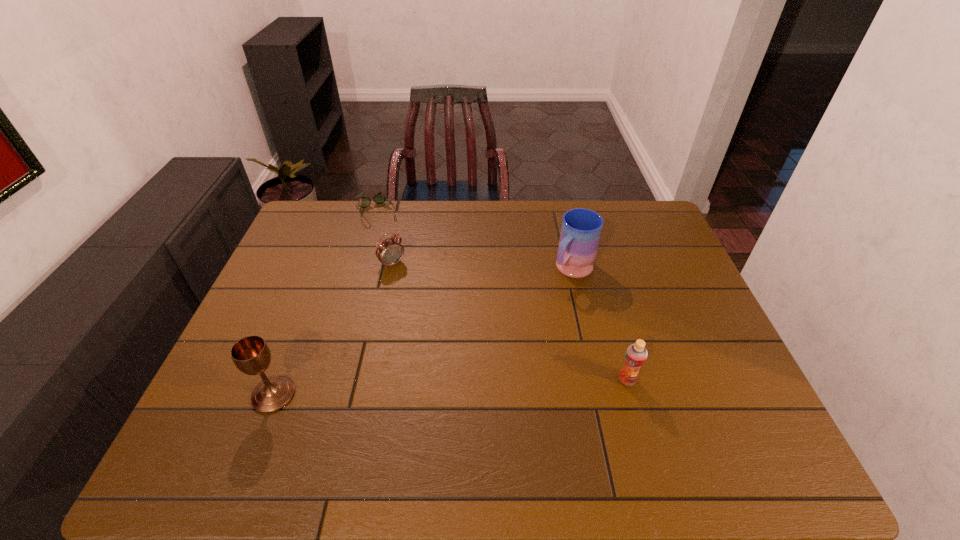
The height and width of the screenshot is (540, 960). Find the location of `free space between the third tallest object and the alarm clock`. free space between the third tallest object and the alarm clock is located at coordinates (510, 322).

Where is `empty space between the chalice and the mug`? empty space between the chalice and the mug is located at coordinates (422, 332).

At what (x,y) coordinates should I click in order to perform the action: click on free area in between the alarm clock and the mug. Please return your answer as a coordinate pair (x, y). Image resolution: width=960 pixels, height=540 pixels. Looking at the image, I should click on (482, 267).

Where is `empty space between the alarm clock and the mug`? This screenshot has height=540, width=960. empty space between the alarm clock and the mug is located at coordinates (482, 267).

This screenshot has width=960, height=540. I want to click on vacant region between the fourth tallest object and the mug, so click(x=482, y=267).

The width and height of the screenshot is (960, 540). I want to click on vacant area between the chalice and the farthest object, so click(x=324, y=304).

Image resolution: width=960 pixels, height=540 pixels. I want to click on object that stands as the closest to the mug, so click(636, 354).

Locate which object is the fourth closest to the mug. Please provide its 2D coordinates. Your answer should be formatted as a tuple, i.e. [(x, y)], where the tuple contains the x and y coordinates of a point satisfying the conditions above.

[(251, 355)]

I want to click on free space that satisfies the following two spatial constraints: 1. on the front side of the spectacles; 2. on the right side of the mug, so click(x=358, y=269).